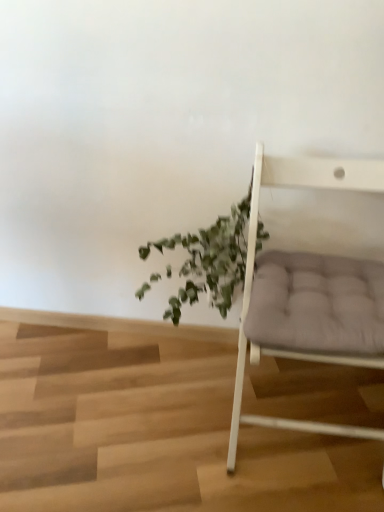
Question: Based on their positions, is matte gray cushion at right located to the left or right of green leafy plant at center?

Choices:
 (A) left
 (B) right

Answer: (B)

Question: From a real-world perspective, is matte gray cushion at right above or below green leafy plant at center?

Choices:
 (A) above
 (B) below

Answer: (A)

Question: In terms of height, does matte gray cushion at right look taller or shorter compared to green leafy plant at center?

Choices:
 (A) tall
 (B) short

Answer: (A)

Question: From a real-world perspective, relative to matte gray cushion at right, is green leafy plant at center vertically above or below?

Choices:
 (A) below
 (B) above

Answer: (A)

Question: Is green leafy plant at center in front of or behind matte gray cushion at right in the image?

Choices:
 (A) behind
 (B) front

Answer: (A)

Question: In terms of height, does green leafy plant at center look taller or shorter compared to matte gray cushion at right?

Choices:
 (A) tall
 (B) short

Answer: (B)

Question: Is point (228, 270) closer or farther from the camera than point (253, 345)?

Choices:
 (A) farther
 (B) closer

Answer: (A)